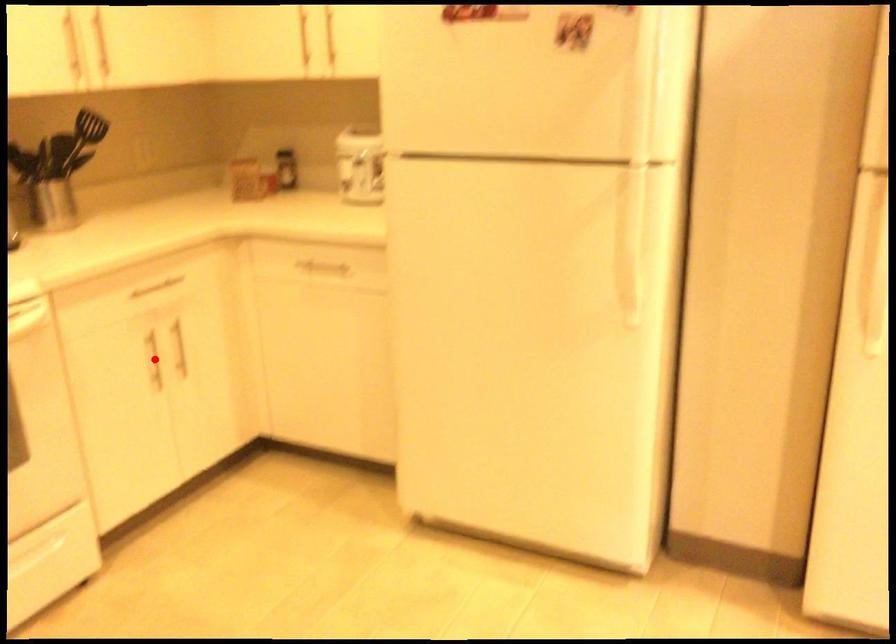
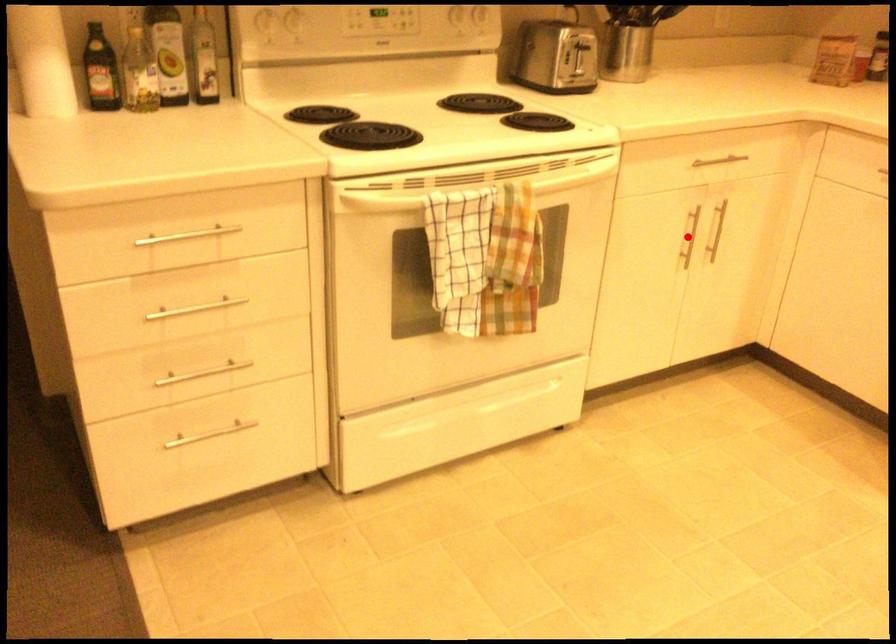
I am providing you with two images of the same scene from different viewpoints. A red point is marked on the first image and another point is marked on the second image. Are the points marked in image1 and image2 representing the same 3D position?

Yes